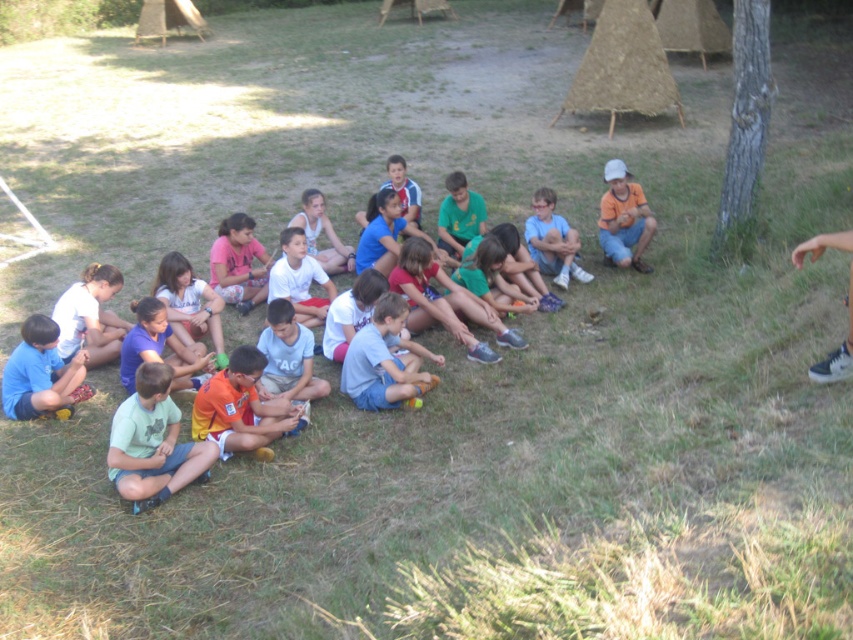
Question: Which object is the farthest from the blue fabric shorts at lower left?

Choices:
 (A) light blue t-shirt at center
 (B) gray rough bark tree at upper right
 (C) blue cotton shirt at center

Answer: (B)

Question: Does blue fabric shorts at lower left have a lesser width compared to white fabric shoe at lower right?

Choices:
 (A) no
 (B) yes

Answer: (A)

Question: Is orange cotton shirt at right further to the viewer compared to blue t-shirt at center?

Choices:
 (A) no
 (B) yes

Answer: (A)

Question: Which point is closer to the camera taking this photo?

Choices:
 (A) (137, 406)
 (B) (648, 220)
 (C) (833, 371)
 (D) (402, 195)

Answer: (C)

Question: Does green cotton shirt at lower left appear under blue t-shirt at center?

Choices:
 (A) no
 (B) yes

Answer: (B)

Question: Which of the following is the closest to the observer?

Choices:
 (A) (399, 173)
 (B) (432, 444)
 (C) (158, 404)

Answer: (C)